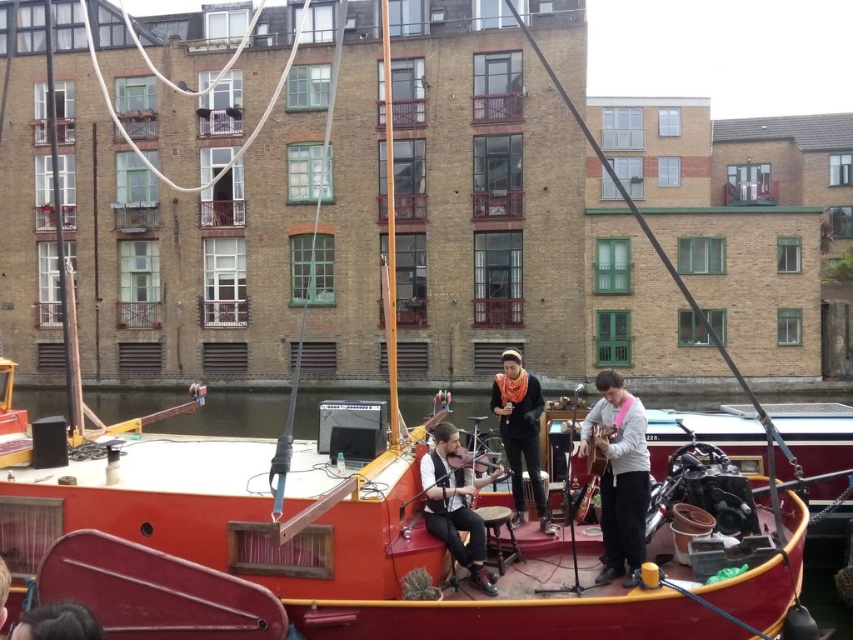
Question: Among these objects, which one is farthest from the camera?

Choices:
 (A) dark brown hair at lower left
 (B) matte black violin at center
 (C) black leather jacket at center
 (D) smooth wooden boat at center

Answer: (D)

Question: Can you confirm if matte black violin at center is smaller than black leather jacket at center?

Choices:
 (A) no
 (B) yes

Answer: (B)

Question: Which of the following is the farthest from the observer?

Choices:
 (A) smooth wooden boat at center
 (B) black leather jacket at center
 (C) dark brown hair at lower left

Answer: (A)

Question: Which point appears farthest from the camera in this image?

Choices:
 (A) (158, 397)
 (B) (434, 451)
 (C) (527, 444)
 (D) (86, 628)

Answer: (A)

Question: Does matte black violin at center have a smaller size compared to dark brown hair at lower left?

Choices:
 (A) yes
 (B) no

Answer: (B)

Question: Considering the relative positions of smooth wooden boat at center and wooden acoustic guitar at center in the image provided, where is smooth wooden boat at center located with respect to wooden acoustic guitar at center?

Choices:
 (A) right
 (B) left

Answer: (A)